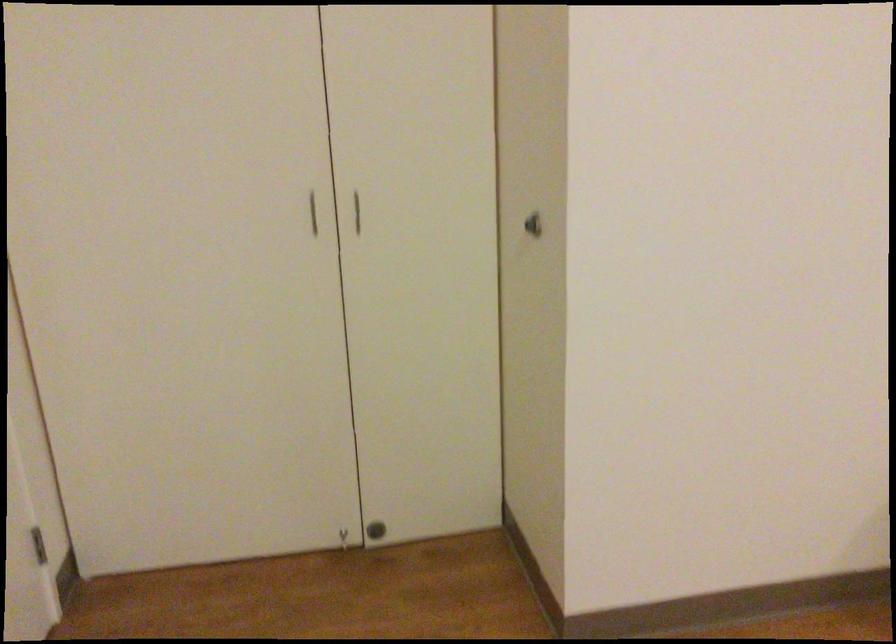
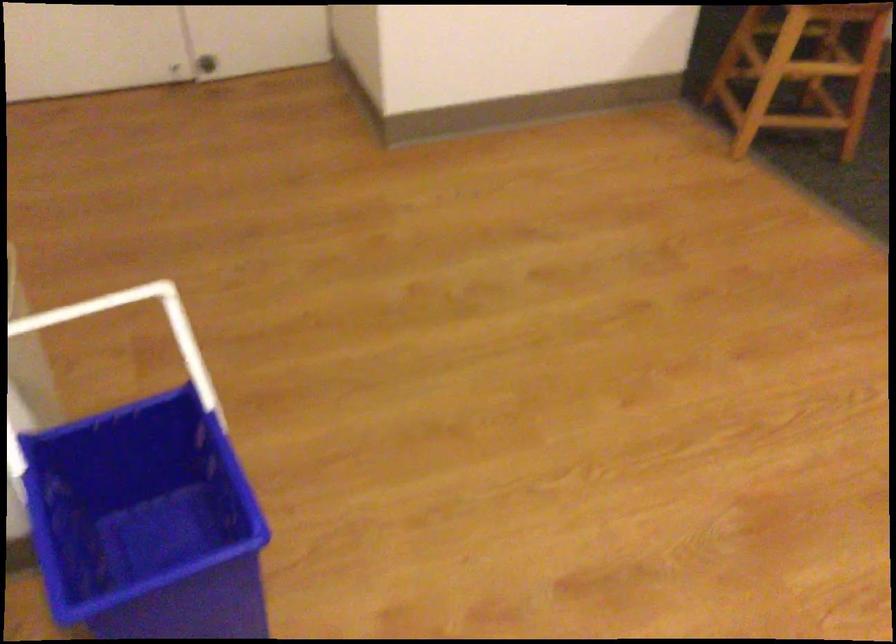
Question: The images are taken continuously from a first-person perspective. In which direction is your viewpoint rotating?

Choices:
 (A) Left
 (B) Right
 (C) Up
 (D) Down

Answer: (D)